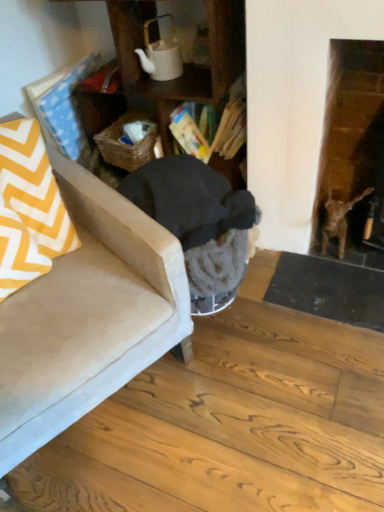
Where is `yellow and white zigzag fabric at left`? This screenshot has width=384, height=512. yellow and white zigzag fabric at left is located at coordinates (29, 208).

Measure the distance between yellow and white zigzag fabric at left and camera.

yellow and white zigzag fabric at left is 3.94 feet from camera.

Find the location of a particular element. The image size is (384, 512). suede beige chair at lower left is located at coordinates (87, 316).

Where is `woven brown basket at center`? woven brown basket at center is located at coordinates (125, 144).

Identify the location of white matte teapot at upper center. (161, 54).

From a real-world perspective, who is located lower, white matte teapot at upper center or suede beige chair at lower left?

suede beige chair at lower left.

Considering the sizes of objects white matte teapot at upper center and suede beige chair at lower left in the image provided, who is thinner, white matte teapot at upper center or suede beige chair at lower left?

white matte teapot at upper center.

Consider the image. How many degrees apart are the facing directions of white matte teapot at upper center and suede beige chair at lower left?

The facing directions of white matte teapot at upper center and suede beige chair at lower left are 62.8 degrees apart.

Which is closer, (x=166, y=58) or (x=171, y=335)?

The point (x=171, y=335) is closer.

Identify the location of basket that is under the white matte teapot at upper center (from a real-world perspective). (125, 144).

Is point (151, 73) closer or farther from the camera than point (140, 145)?

Point (151, 73) is closer to the camera than point (140, 145).

Which object is closer to the camera, white matte teapot at upper center or woven brown basket at center?

white matte teapot at upper center is closer to the camera.

Can you confirm if white matte teapot at upper center is wider than woven brown basket at center?

In fact, white matte teapot at upper center might be narrower than woven brown basket at center.

Is wooden cabinet at center thinner than woven brown basket at center?

No, wooden cabinet at center is not thinner than woven brown basket at center.

How many degrees apart are the facing directions of wooden cabinet at center and woven brown basket at center?

10.1 degrees.

From a real-world perspective, is wooden cabinet at center physically below woven brown basket at center?

Incorrect, from a real-world perspective, wooden cabinet at center is higher than woven brown basket at center.

This screenshot has width=384, height=512. In order to click on basket below the wooden cabinet at center (from a real-world perspective) in this screenshot , I will do `click(125, 144)`.

Is woven brown basket at center with white matte teapot at upper center?

woven brown basket at center is not next to white matte teapot at upper center, and they're not touching.

Can you tell me how much woven brown basket at center and white matte teapot at upper center differ in facing direction?

They differ by 10.1 degrees in their facing directions.

Where is `basket below the white matte teapot at upper center (from the image's perspective)`? This screenshot has height=512, width=384. basket below the white matte teapot at upper center (from the image's perspective) is located at coordinates (125, 144).

From a real-world perspective, who is located higher, suede beige chair at lower left or wooden cabinet at center?

In real-world perspective, wooden cabinet at center is above.

Based on their sizes in the image, would you say suede beige chair at lower left is bigger or smaller than wooden cabinet at center?

suede beige chair at lower left is bigger than wooden cabinet at center.

Between suede beige chair at lower left and wooden cabinet at center, which one appears on the left side from the viewer's perspective?

From the viewer's perspective, suede beige chair at lower left appears more on the left side.

Which of these two, wooden cabinet at center or yellow and white zigzag fabric at left, is bigger?

wooden cabinet at center is bigger.

In the image, there is a wooden cabinet at center. Where is `throw pillow below it (from a real-world perspective)`? throw pillow below it (from a real-world perspective) is located at coordinates (29, 208).

Is wooden cabinet at center further to the viewer compared to yellow and white zigzag fabric at left?

Yes, the depth of wooden cabinet at center is greater than that of yellow and white zigzag fabric at left.

Is point (216, 165) positioned in front of point (49, 175)?

No, it is behind (49, 175).

In the scene shown: Considering the positions of objects yellow and white zigzag fabric at left and white matte teapot at upper center in the image provided, who is more to the left, yellow and white zigzag fabric at left or white matte teapot at upper center?

Positioned to the left is yellow and white zigzag fabric at left.

Is white matte teapot at upper center at the back of yellow and white zigzag fabric at left?

No, white matte teapot at upper center is not at the back of yellow and white zigzag fabric at left.

From a real-world perspective, which is physically below, yellow and white zigzag fabric at left or white matte teapot at upper center?

yellow and white zigzag fabric at left.

Considering the sizes of objects yellow and white zigzag fabric at left and white matte teapot at upper center in the image provided, who is taller, yellow and white zigzag fabric at left or white matte teapot at upper center?

yellow and white zigzag fabric at left.

I want to click on chair lying in front of the white matte teapot at upper center, so click(x=87, y=316).

At what (x,y) coordinates should I click in order to perform the action: click on basket located below the white matte teapot at upper center (from the image's perspective). Please return your answer as a coordinate pair (x, y). This screenshot has height=512, width=384. Looking at the image, I should click on (125, 144).

Based on their spatial positions, is white matte teapot at upper center or woven brown basket at center further from suede beige chair at lower left?

white matte teapot at upper center is positioned further to the anchor suede beige chair at lower left.

Estimate the real-world distances between objects in this image. Which object is further from suede beige chair at lower left, wooden cabinet at center or white matte teapot at upper center?

Based on the image, white matte teapot at upper center appears to be further to suede beige chair at lower left.

Estimate the real-world distances between objects in this image. Which object is closer to yellow and white zigzag fabric at left, woven brown basket at center or white matte teapot at upper center?

woven brown basket at center lies closer to yellow and white zigzag fabric at left than the other object.

Looking at the image, which one is located further to wooden cabinet at center, yellow and white zigzag fabric at left or woven brown basket at center?

yellow and white zigzag fabric at left.

Considering their positions, is suede beige chair at lower left positioned closer to wooden cabinet at center than white matte teapot at upper center?

white matte teapot at upper center lies closer to wooden cabinet at center than the other object.

Consider the image. Considering their positions, is wooden cabinet at center positioned closer to yellow and white zigzag fabric at left than white matte teapot at upper center?

Among the two, wooden cabinet at center is located nearer to yellow and white zigzag fabric at left.

Looking at the image, which one is located closer to wooden cabinet at center, white matte teapot at upper center or woven brown basket at center?

white matte teapot at upper center is positioned closer to the anchor wooden cabinet at center.

Based on their spatial positions, is woven brown basket at center or white matte teapot at upper center further from wooden cabinet at center?

woven brown basket at center is further to wooden cabinet at center.

Locate an element on the screen. Image resolution: width=384 pixels, height=512 pixels. basket between white matte teapot at upper center and yellow and white zigzag fabric at left in the up-down direction is located at coordinates (125, 144).

I want to click on tea pot between suede beige chair at lower left and woven brown basket at center along the z-axis, so click(161, 54).

At what (x,y) coordinates should I click in order to perform the action: click on cabinetry between yellow and white zigzag fabric at left and woven brown basket at center from front to back. Please return your answer as a coordinate pair (x, y). This screenshot has width=384, height=512. Looking at the image, I should click on (185, 64).

Find the location of a particular element. throw pillow between wooden cabinet at center and suede beige chair at lower left vertically is located at coordinates (29, 208).